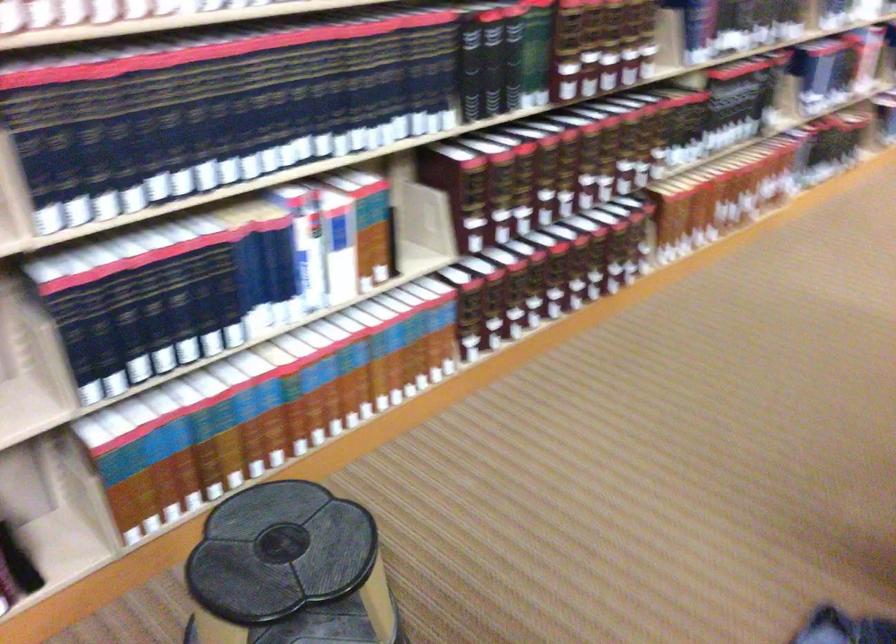
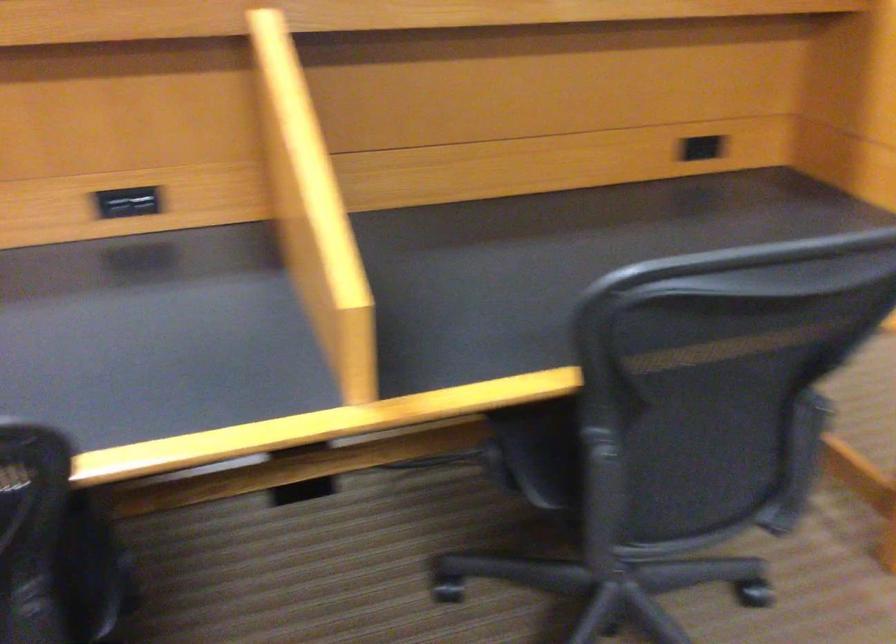
Question: I am providing you with two images of the same scene from different viewpoints. Which of the following objects are not visible in image2?

Choices:
 (A) wrapped soap bar
 (B) chair sitting surface
 (C) black power outlet
 (D) black spine book

Answer: (D)